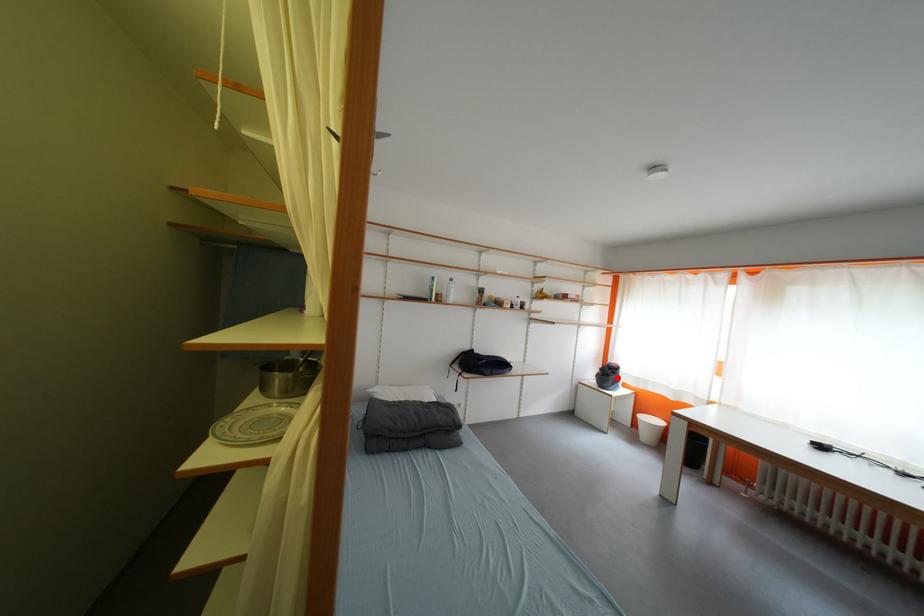
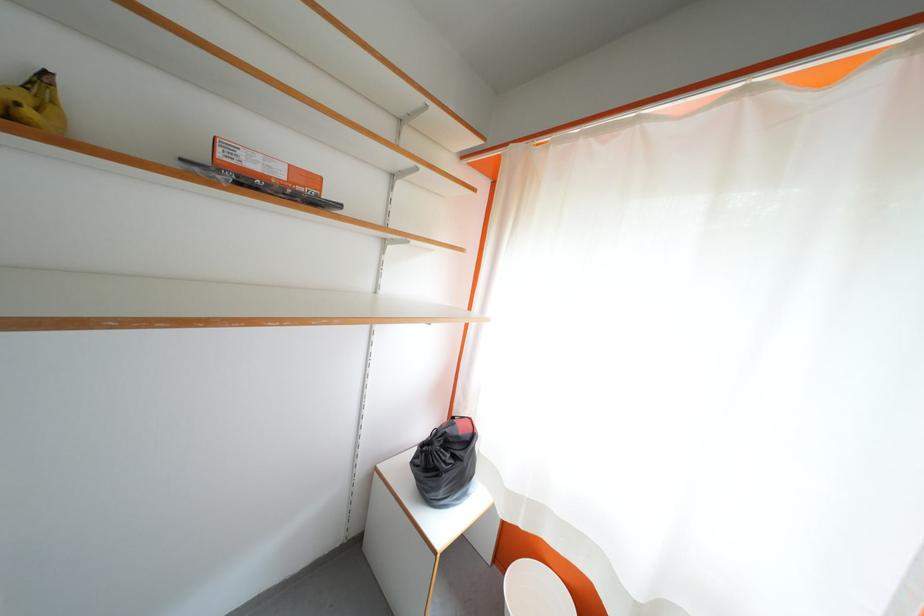
In the second image, find the point that corresponds to the highlighted location in the first image.

(455, 460)